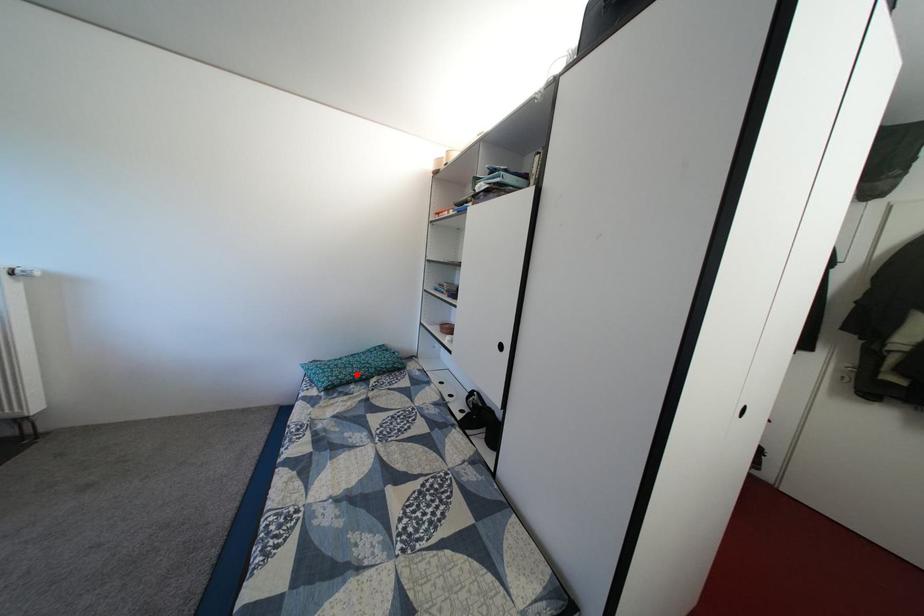
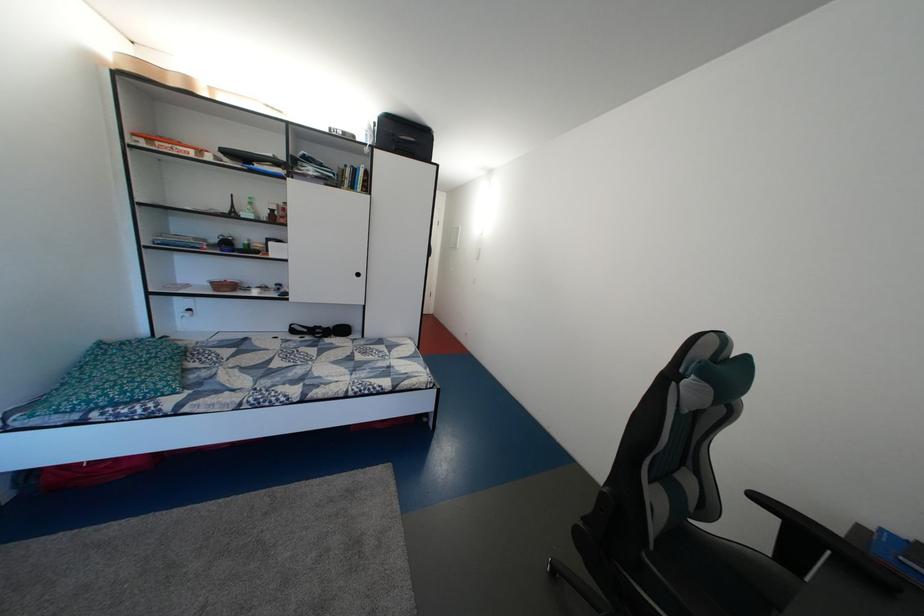
Question: I am providing you with two images of the same scene from different viewpoints. A red point is marked on the first image. Is the red point's position out of view in image 2?

Choices:
 (A) Yes
 (B) No

Answer: (B)